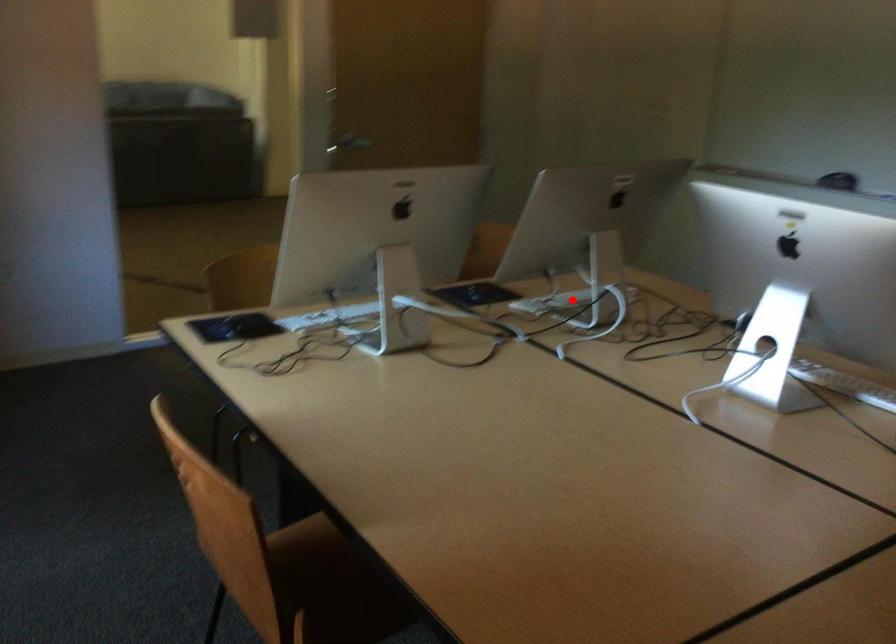
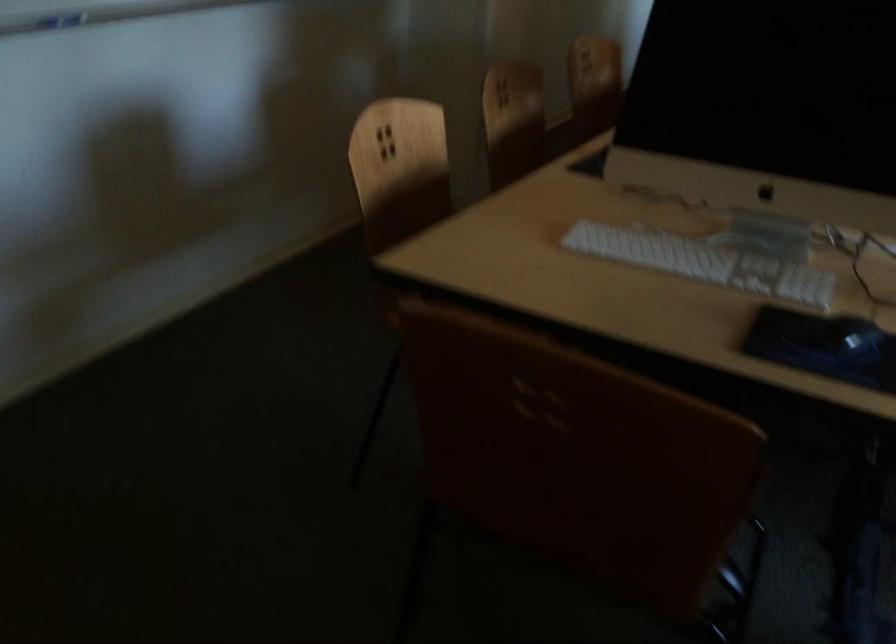
Question: I am providing you with two images of the same scene from different viewpoints. A red point is shown in image1. For the corresponding object point in image2, is it positioned nearer or farther from the camera?

Choices:
 (A) Nearer
 (B) Farther

Answer: (A)